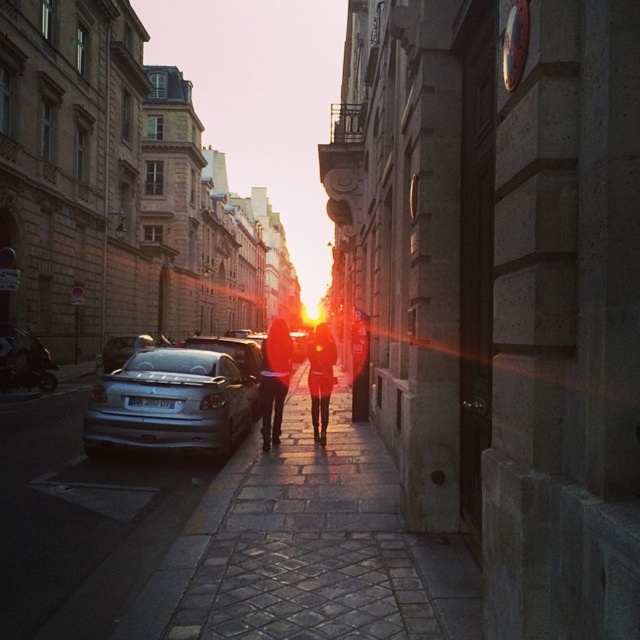
You are a delivery person trying to park your motorcycle between the silver metallic car at left and the matte black jacket at center. Can you fit your motorcycle there if it requires 1.2 meters of space?

The silver metallic car at left has a smaller size compared to matte black jacket at center, but without knowing the exact distance between them, it is impossible to determine if there is enough space for the motorcycle requiring 1.2 meters.

Consider the image. You are a delivery person trying to park your 1.5 meter tall delivery robot in the street. The robot needs to be placed between the cobblestone pavement at center and the silver metallic car at left. Is there enough vertical clearance for the robot to fit between them?

The cobblestone pavement at center is not as tall as the silver metallic car at left, so the vertical clearance between them would be sufficient for the robot since the pavement is lower and the car is taller. The robot at 1.5 meters should fit vertically between them.

You are a delivery person trying to park your scooter on the cobblestone pavement at center. However, there is a silver metallic car at left blocking the path. Based on the scene description, can you safely maneuver your scooter around the car to reach the pavement?

The cobblestone pavement at center is located below the silver metallic car at left, which means the car is positioned above the pavement. Since the car is blocking the path, you cannot safely maneuver your scooter around it to reach the pavement.